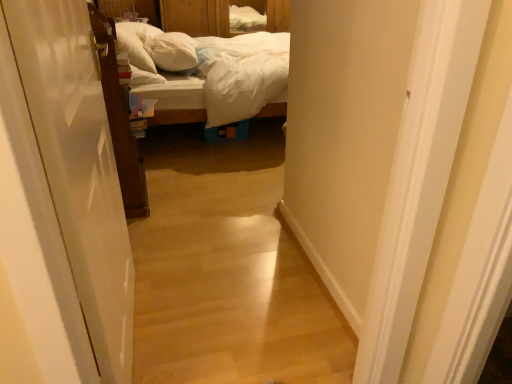
Where is `white soft pillow at center, which is counted as the second pillow, starting from the left`? This screenshot has width=512, height=384. white soft pillow at center, which is counted as the second pillow, starting from the left is located at coordinates (172, 51).

I want to click on brown wooden door at left, the 2th door in the front-to-back sequence, so click(x=119, y=119).

The height and width of the screenshot is (384, 512). I want to click on wooden bed at center, so click(156, 71).

The width and height of the screenshot is (512, 384). Describe the element at coordinates (136, 43) in the screenshot. I see `white soft pillow at upper left, placed as the second pillow when sorted from right to left` at that location.

Where is `white glossy door at left, which ranks as the second door in left-to-right order`? This screenshot has width=512, height=384. white glossy door at left, which ranks as the second door in left-to-right order is located at coordinates (76, 167).

Based on the photo, between white glossy door at left, which ranks as the second door in left-to-right order, and white soft pillow at center, placed as the first pillow when sorted from right to left, which one has smaller width?

Thinner between the two is white glossy door at left, which ranks as the second door in left-to-right order.

Is white glossy door at left, which is the 1th door from right to left, to the right of white soft pillow at center, which is counted as the second pillow, starting from the left, from the viewer's perspective?

Correct, you'll find white glossy door at left, which is the 1th door from right to left, to the right of white soft pillow at center, which is counted as the second pillow, starting from the left.

Choose the correct answer: Is white glossy door at left, which is the 1th door from right to left, inside white soft pillow at center, placed as the first pillow when sorted from right to left, or outside it?

white glossy door at left, which is the 1th door from right to left, lies outside white soft pillow at center, placed as the first pillow when sorted from right to left.

Is white soft pillow at upper left, the first pillow viewed from the left, directly adjacent to wooden bed at center?

There is a gap between white soft pillow at upper left, the first pillow viewed from the left, and wooden bed at center.

From a real-world perspective, who is located higher, white soft pillow at upper left, placed as the second pillow when sorted from right to left, or wooden bed at center?

white soft pillow at upper left, placed as the second pillow when sorted from right to left, from a real-world perspective.

Is white soft pillow at upper left, the first pillow viewed from the left, thinner than wooden bed at center?

Indeed, white soft pillow at upper left, the first pillow viewed from the left, has a lesser width compared to wooden bed at center.

From the image's perspective, is white soft pillow at upper left, the first pillow viewed from the left, beneath wooden bed at center?

No, from the image's perspective, white soft pillow at upper left, the first pillow viewed from the left, is not below wooden bed at center.

Considering the positions of objects white soft pillow at upper left, the first pillow viewed from the left, and brown wooden door at left, which ranks as the first door in back-to-front order, in the image provided, who is behind, white soft pillow at upper left, the first pillow viewed from the left, or brown wooden door at left, which ranks as the first door in back-to-front order,?

Positioned behind is white soft pillow at upper left, the first pillow viewed from the left.

Does white soft pillow at upper left, placed as the second pillow when sorted from right to left, touch brown wooden door at left, which ranks as the 1th door in left-to-right order?

There is a gap between white soft pillow at upper left, placed as the second pillow when sorted from right to left, and brown wooden door at left, which ranks as the 1th door in left-to-right order.

Can you confirm if white soft pillow at upper left, the first pillow viewed from the left, is positioned to the right of brown wooden door at left, the 2th door in the front-to-back sequence?

In fact, white soft pillow at upper left, the first pillow viewed from the left, is to the left of brown wooden door at left, the 2th door in the front-to-back sequence.

Measure the distance from white soft pillow at upper left, the first pillow viewed from the left, to brown wooden door at left, which ranks as the 1th door in left-to-right order.

A distance of 37.32 inches exists between white soft pillow at upper left, the first pillow viewed from the left, and brown wooden door at left, which ranks as the 1th door in left-to-right order.

Is white soft pillow at center, placed as the first pillow when sorted from right to left, next to wooden bed at center?

white soft pillow at center, placed as the first pillow when sorted from right to left, and wooden bed at center are clearly separated.

Can wooden bed at center be found inside white soft pillow at center, which is counted as the second pillow, starting from the left?

No, wooden bed at center is not inside white soft pillow at center, which is counted as the second pillow, starting from the left.

Can you tell me how much white soft pillow at center, placed as the first pillow when sorted from right to left, and wooden bed at center differ in facing direction?

The angular difference between white soft pillow at center, placed as the first pillow when sorted from right to left, and wooden bed at center is 11 degrees.

Is the position of white soft pillow at center, placed as the first pillow when sorted from right to left, less distant than that of wooden bed at center?

No.

Considering the relative sizes of brown wooden door at left, the 2th door in the front-to-back sequence, and white soft pillow at center, placed as the first pillow when sorted from right to left, in the image provided, is brown wooden door at left, the 2th door in the front-to-back sequence, bigger than white soft pillow at center, placed as the first pillow when sorted from right to left,?

Correct, brown wooden door at left, the 2th door in the front-to-back sequence, is larger in size than white soft pillow at center, placed as the first pillow when sorted from right to left.

Is brown wooden door at left, which ranks as the first door in back-to-front order, inside or outside of white soft pillow at center, placed as the first pillow when sorted from right to left?

brown wooden door at left, which ranks as the first door in back-to-front order, is not enclosed by white soft pillow at center, placed as the first pillow when sorted from right to left.

Which is less distant, (121,146) or (197,63)?

Point (121,146) is closer to the camera than point (197,63).

Is brown wooden door at left, which ranks as the 1th door in left-to-right order, turned away from white soft pillow at center, placed as the first pillow when sorted from right to left?

No, white soft pillow at center, placed as the first pillow when sorted from right to left, is not at the back of brown wooden door at left, which ranks as the 1th door in left-to-right order.

In the scene shown: From the image's perspective, would you say white soft pillow at center, which is counted as the second pillow, starting from the left, is shown under white soft pillow at upper left, the first pillow viewed from the left?

No, from the image's perspective, white soft pillow at center, which is counted as the second pillow, starting from the left, is not beneath white soft pillow at upper left, the first pillow viewed from the left.

Looking at this image, are white soft pillow at center, placed as the first pillow when sorted from right to left, and white soft pillow at upper left, placed as the second pillow when sorted from right to left, beside each other?

white soft pillow at center, placed as the first pillow when sorted from right to left, and white soft pillow at upper left, placed as the second pillow when sorted from right to left, are clearly separated.

Considering the relative positions of white soft pillow at center, which is counted as the second pillow, starting from the left, and white soft pillow at upper left, placed as the second pillow when sorted from right to left, in the image provided, is white soft pillow at center, which is counted as the second pillow, starting from the left, in front of white soft pillow at upper left, placed as the second pillow when sorted from right to left,?

No.

Is white soft pillow at upper left, placed as the second pillow when sorted from right to left, located within white soft pillow at center, which is counted as the second pillow, starting from the left?

Definitely not — white soft pillow at upper left, placed as the second pillow when sorted from right to left, is not inside white soft pillow at center, which is counted as the second pillow, starting from the left.

Consider the image. From their relative heights in the image, would you say wooden bed at center is taller or shorter than white soft pillow at upper left, the first pillow viewed from the left?

Clearly, wooden bed at center is taller compared to white soft pillow at upper left, the first pillow viewed from the left.

Do you think wooden bed at center is within white soft pillow at upper left, placed as the second pillow when sorted from right to left, or outside of it?

wooden bed at center is located beyond the bounds of white soft pillow at upper left, placed as the second pillow when sorted from right to left.

Does wooden bed at center have a lesser width compared to white soft pillow at upper left, the first pillow viewed from the left?

No, wooden bed at center is not thinner than white soft pillow at upper left, the first pillow viewed from the left.

From the image's perspective, relative to white soft pillow at upper left, the first pillow viewed from the left, is wooden bed at center above or below?

wooden bed at center is below white soft pillow at upper left, the first pillow viewed from the left.

You are a GUI agent. You are given a task and a screenshot of the screen. Output one action in this format:
    pyautogui.click(x=<x>, y=<y>)
    Task: Click on the door on the right of white soft pillow at center, which is counted as the second pillow, starting from the left
    The height and width of the screenshot is (384, 512).
    Given the screenshot: What is the action you would take?
    pyautogui.click(x=76, y=167)

Where is `bed below the white soft pillow at upper left, the first pillow viewed from the left (from the image's perspective)`? This screenshot has height=384, width=512. bed below the white soft pillow at upper left, the first pillow viewed from the left (from the image's perspective) is located at coordinates (156, 71).

From the image, which object appears to be nearer to white soft pillow at center, which is counted as the second pillow, starting from the left, white soft pillow at upper left, the first pillow viewed from the left, or wooden bed at center?

white soft pillow at upper left, the first pillow viewed from the left.

Estimate the real-world distances between objects in this image. Which object is further from brown wooden door at left, the 2th door in the front-to-back sequence, white soft pillow at center, placed as the first pillow when sorted from right to left, or white glossy door at left, which is the 1th door from right to left?

Among the two, white soft pillow at center, placed as the first pillow when sorted from right to left, is located further to brown wooden door at left, the 2th door in the front-to-back sequence.

Estimate the real-world distances between objects in this image. Which object is closer to white glossy door at left, positioned as the first door in front-to-back order, white soft pillow at center, placed as the first pillow when sorted from right to left, or brown wooden door at left, the second door from the right?

Based on the image, brown wooden door at left, the second door from the right, appears to be nearer to white glossy door at left, positioned as the first door in front-to-back order.

Looking at the image, which one is located further to wooden bed at center, white glossy door at left, which ranks as the second door in left-to-right order, or white soft pillow at upper left, placed as the second pillow when sorted from right to left?

The object further to wooden bed at center is white glossy door at left, which ranks as the second door in left-to-right order.

When comparing their distances from brown wooden door at left, which ranks as the 1th door in left-to-right order, does white glossy door at left, which is the 1th door from right to left, or white soft pillow at center, placed as the first pillow when sorted from right to left, seem closer?

Based on the image, white glossy door at left, which is the 1th door from right to left, appears to be nearer to brown wooden door at left, which ranks as the 1th door in left-to-right order.

From the image, which object appears to be farther from brown wooden door at left, the second door from the right, white glossy door at left, which is the 1th door from right to left, or wooden bed at center?

white glossy door at left, which is the 1th door from right to left, is positioned further to the anchor brown wooden door at left, the second door from the right.

From the image, which object appears to be farther from white glossy door at left, which ranks as the second door in left-to-right order, wooden bed at center or brown wooden door at left, the second door from the right?

wooden bed at center is positioned further to the anchor white glossy door at left, which ranks as the second door in left-to-right order.

Considering their positions, is wooden bed at center positioned further to white soft pillow at upper left, the first pillow viewed from the left, than white soft pillow at center, which is counted as the second pillow, starting from the left?

The object further to white soft pillow at upper left, the first pillow viewed from the left, is wooden bed at center.

At what (x,y) coordinates should I click in order to perform the action: click on pillow situated between white soft pillow at upper left, placed as the second pillow when sorted from right to left, and wooden bed at center from left to right. Please return your answer as a coordinate pair (x, y). Image resolution: width=512 pixels, height=384 pixels. Looking at the image, I should click on (172, 51).

Locate an element on the screen. This screenshot has width=512, height=384. bed located between white glossy door at left, which is the 1th door from right to left, and white soft pillow at upper left, placed as the second pillow when sorted from right to left, in the depth direction is located at coordinates (156, 71).

You are a GUI agent. You are given a task and a screenshot of the screen. Output one action in this format:
    pyautogui.click(x=<x>, y=<y>)
    Task: Click on the pillow located between white glossy door at left, which ranks as the second door in left-to-right order, and white soft pillow at center, which is counted as the second pillow, starting from the left, in the depth direction
    The image size is (512, 384).
    Given the screenshot: What is the action you would take?
    pyautogui.click(x=136, y=43)

Identify the location of door between white glossy door at left, which ranks as the second door in left-to-right order, and white soft pillow at center, which is counted as the second pillow, starting from the left, from front to back. (119, 119).